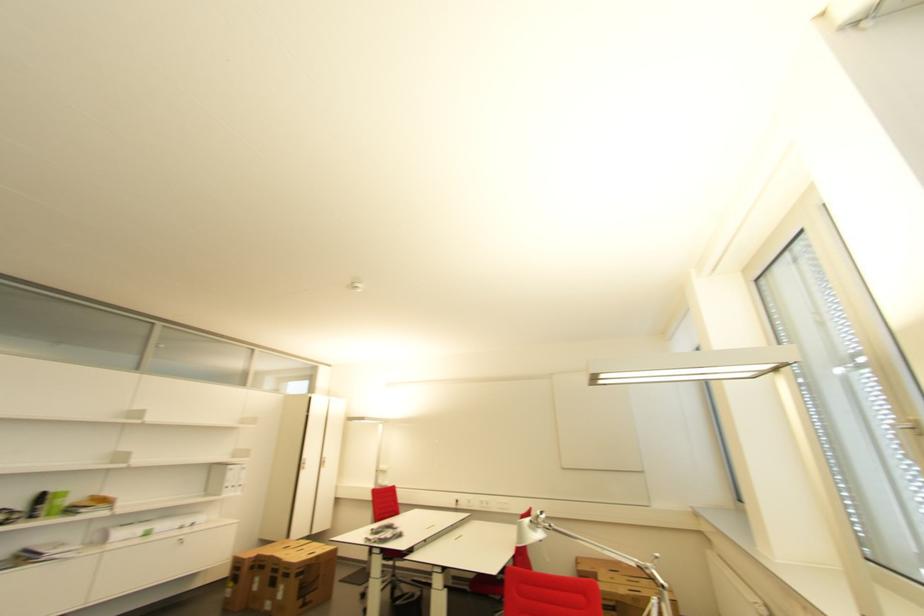
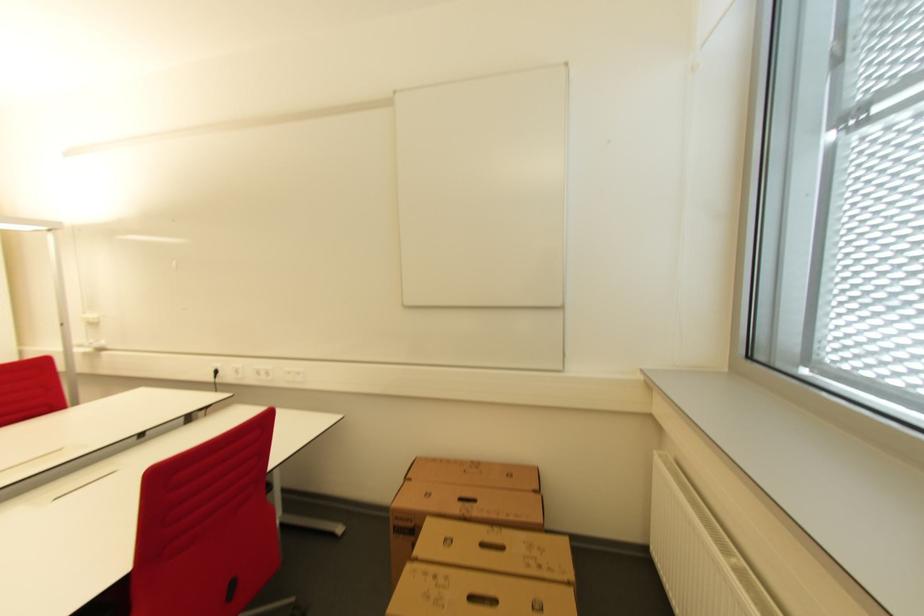
The images are taken continuously from a first-person perspective. In which direction are you moving?

The movement direction of the cameraman is right, forward.